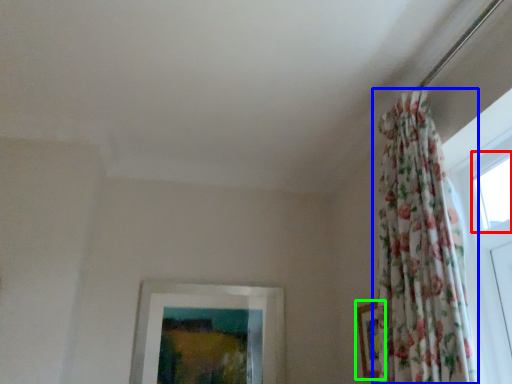
Question: Which object is the closest to the window (highlighted by a red box)? Choose among these: curtain (highlighted by a blue box) or picture frame (highlighted by a green box).

Choices:
 (A) curtain
 (B) picture frame

Answer: (A)